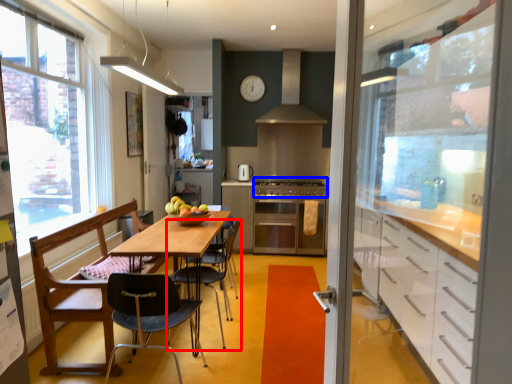
Question: Which object is further to the camera taking this photo, chair (highlighted by a red box) or gas stove (highlighted by a blue box)?

Choices:
 (A) chair
 (B) gas stove

Answer: (B)